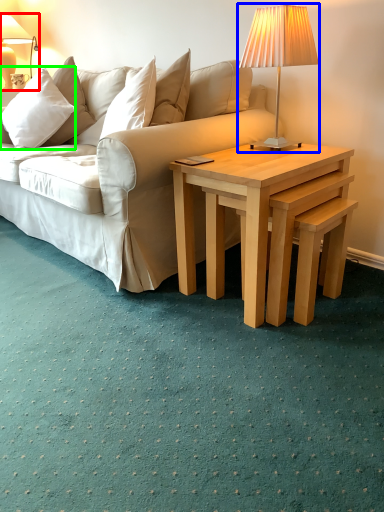
Question: Which object is the farthest from lamp (highlighted by a red box)? Choose among these: lamp (highlighted by a blue box) or pillow (highlighted by a green box).

Choices:
 (A) lamp
 (B) pillow

Answer: (A)